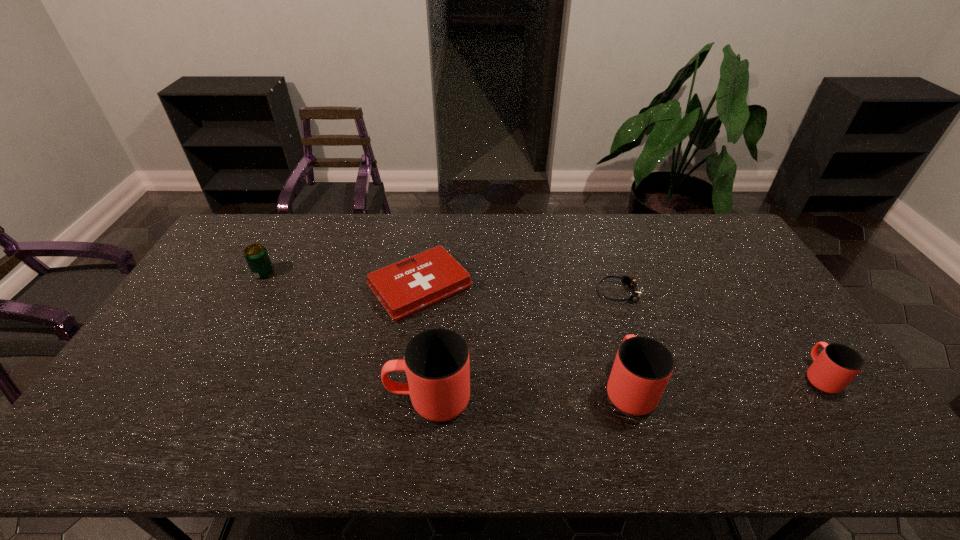
The width and height of the screenshot is (960, 540). In order to click on vacant space located 0.100m on the handle side of the leftmost cup in this screenshot , I will do `click(347, 399)`.

Locate an element on the screen. free space located on the handle side of the second tallest cup is located at coordinates (605, 306).

Where is `vacant space situated on the handle side of the second tallest cup`? vacant space situated on the handle side of the second tallest cup is located at coordinates (612, 328).

Locate an element on the screen. This screenshot has height=540, width=960. vacant space located 0.280m on the handle side of the second tallest cup is located at coordinates (599, 288).

This screenshot has height=540, width=960. What are the coordinates of `vacant space situated on the handle side of the rightmost cup` in the screenshot? It's located at (784, 325).

Image resolution: width=960 pixels, height=540 pixels. In order to click on vacant space located 0.140m on the handle side of the rightmost cup in this screenshot , I will do click(780, 320).

Identify the location of free space located 0.100m on the handle side of the rightmost cup. This screenshot has width=960, height=540. (788, 330).

Where is `free spot located 0.090m on the left of the leftmost object`? free spot located 0.090m on the left of the leftmost object is located at coordinates (227, 273).

Where is `blank space located 0.160m on the front of the first-aid kit`? blank space located 0.160m on the front of the first-aid kit is located at coordinates (408, 369).

Locate an element on the screen. blank area located 0.360m through the lenses of the goggles is located at coordinates (484, 293).